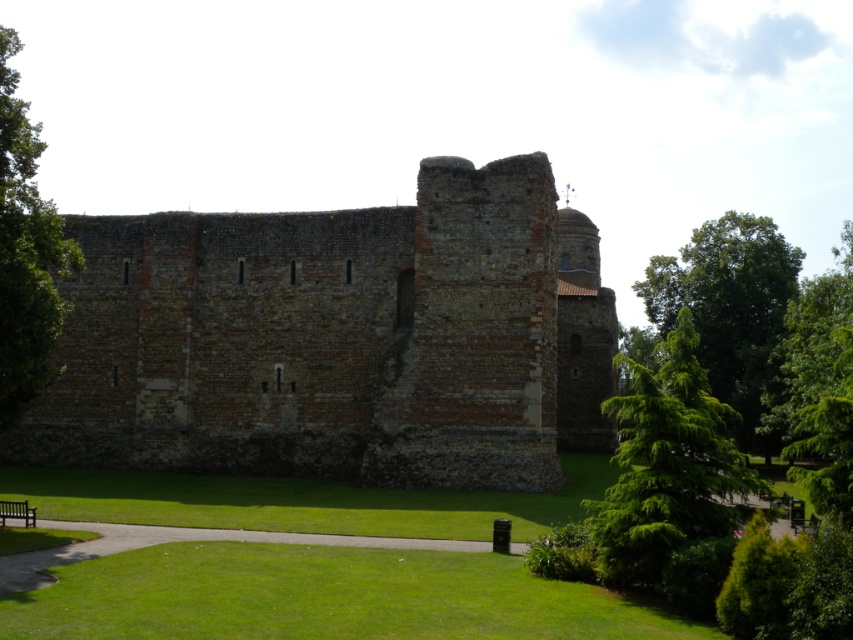
Question: Can you confirm if green needle-like tree at center-right is positioned to the left of green leafy tree at right?

Choices:
 (A) yes
 (B) no

Answer: (A)

Question: Which point is closer to the camera?

Choices:
 (A) green leafy tree at left
 (B) green leafy tree at right

Answer: (B)

Question: Is brown stone wall at center to the left of green needle-like tree at center-right from the viewer's perspective?

Choices:
 (A) no
 (B) yes

Answer: (B)

Question: Which point is farther to the camera?

Choices:
 (A) (643, 502)
 (B) (809, 401)
 (C) (751, 232)
 (D) (45, 292)

Answer: (C)

Question: Which point is farther from the camera taking this photo?

Choices:
 (A) (15, 332)
 (B) (660, 259)
 (C) (693, 401)

Answer: (B)

Question: Does green needle-like tree at center-right appear on the left side of green leafy tree at upper right?

Choices:
 (A) no
 (B) yes

Answer: (B)